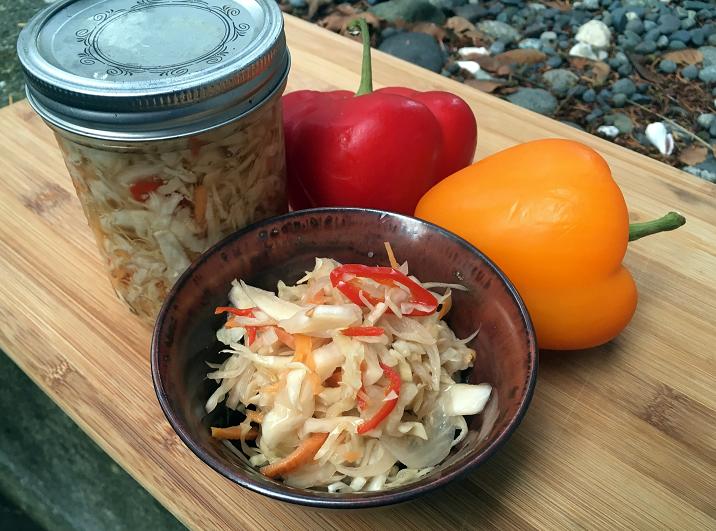
Locate an element on the screen. wood panels is located at coordinates (621, 487), (679, 337), (493, 118), (324, 55), (39, 245), (92, 347).